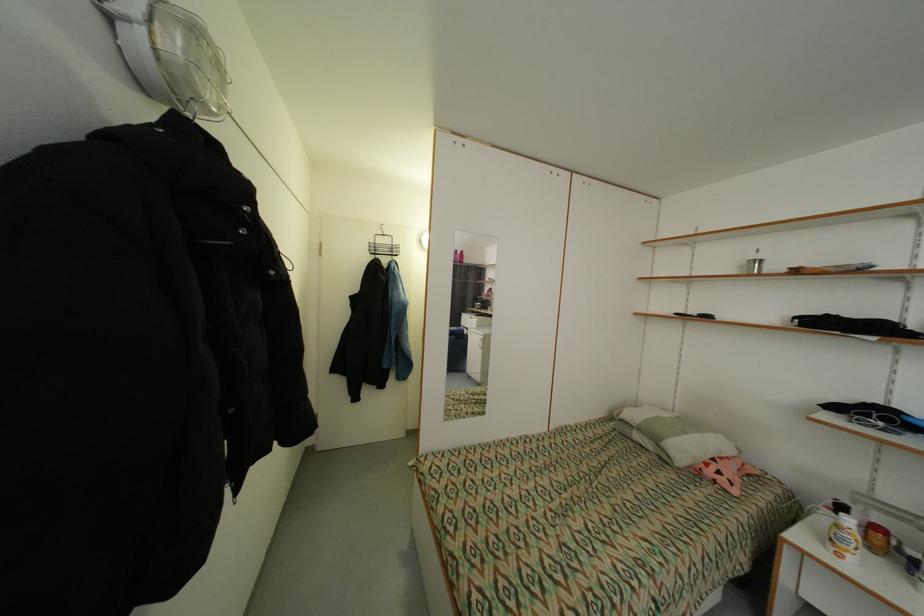
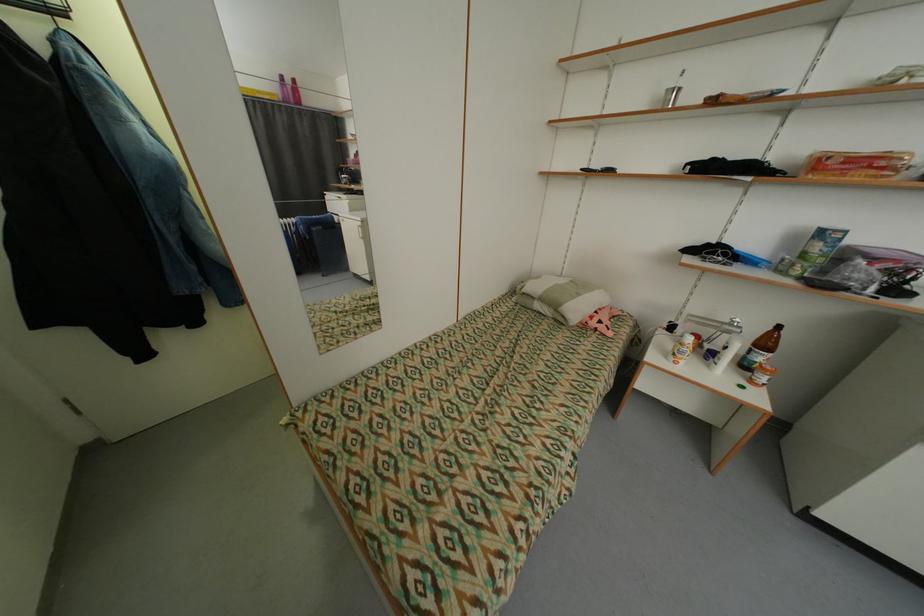
The point at (690,434) is marked in the first image. Where is the corresponding point in the second image?

(585, 296)